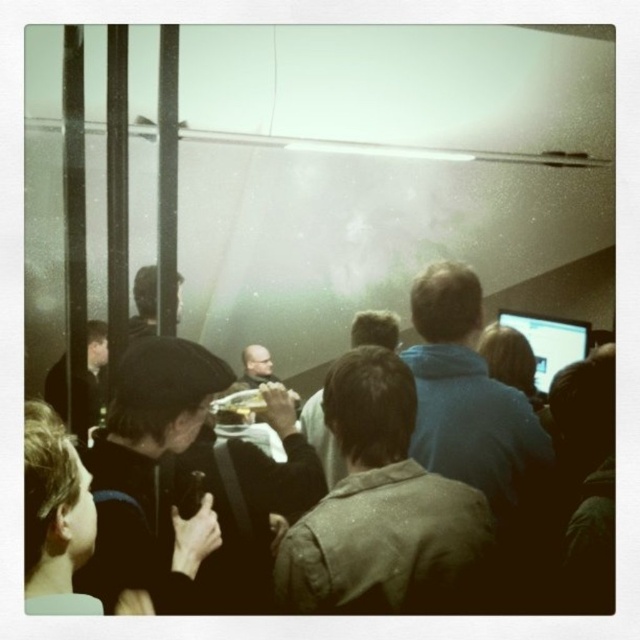
Does dark brown leather jacket at left have a lesser height compared to matte black jacket at center?

Incorrect, dark brown leather jacket at left's height does not fall short of matte black jacket at center's.

Is dark brown leather jacket at left smaller than matte black jacket at center?

Yes, dark brown leather jacket at left is smaller than matte black jacket at center.

Describe the element at coordinates (93, 368) in the screenshot. I see `dark brown leather jacket at left` at that location.

This screenshot has width=640, height=640. I want to click on dark brown leather jacket at left, so tap(93, 368).

Can you confirm if matte black monitor at upper right is positioned to the left of matte black jacket at center?

Incorrect, matte black monitor at upper right is not on the left side of matte black jacket at center.

Between matte black monitor at upper right and matte black jacket at center, which one appears on the right side from the viewer's perspective?

matte black monitor at upper right

Is point (536, 384) positioned before point (272, 364)?

Yes.

Image resolution: width=640 pixels, height=640 pixels. Find the location of `matte black monitor at upper right`. matte black monitor at upper right is located at coordinates (548, 342).

Who is positioned more to the right, blue fleece jacket at center or dark brown leather jacket at center?

From the viewer's perspective, blue fleece jacket at center appears more on the right side.

Which is behind, point (468, 300) or point (397, 323)?

The point (397, 323) is behind.

This screenshot has width=640, height=640. Identify the location of blue fleece jacket at center. (472, 401).